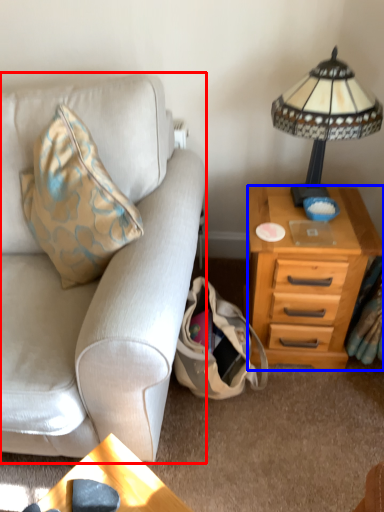
Question: Which object appears closest to the camera in this image, studio couch (highlighted by a red box) or nightstand (highlighted by a blue box)?

Choices:
 (A) studio couch
 (B) nightstand

Answer: (A)